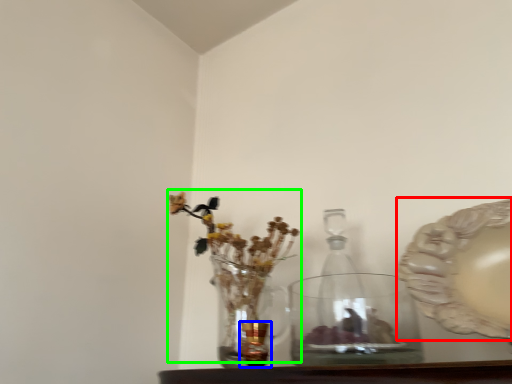
Question: Which object is the farthest from platter (highlighted by a red box)? Choose among these: candle holder (highlighted by a blue box) or floral arrangement (highlighted by a green box).

Choices:
 (A) candle holder
 (B) floral arrangement

Answer: (B)